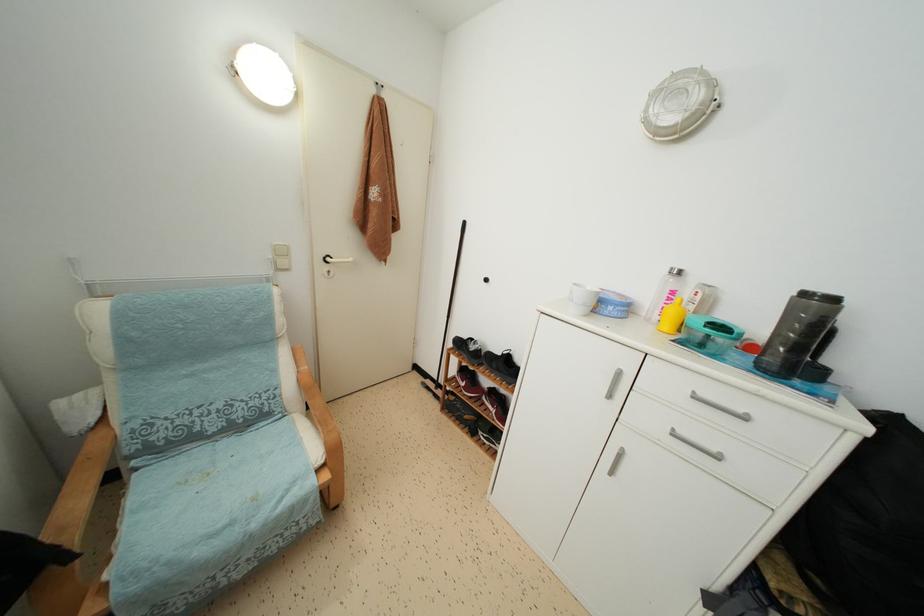
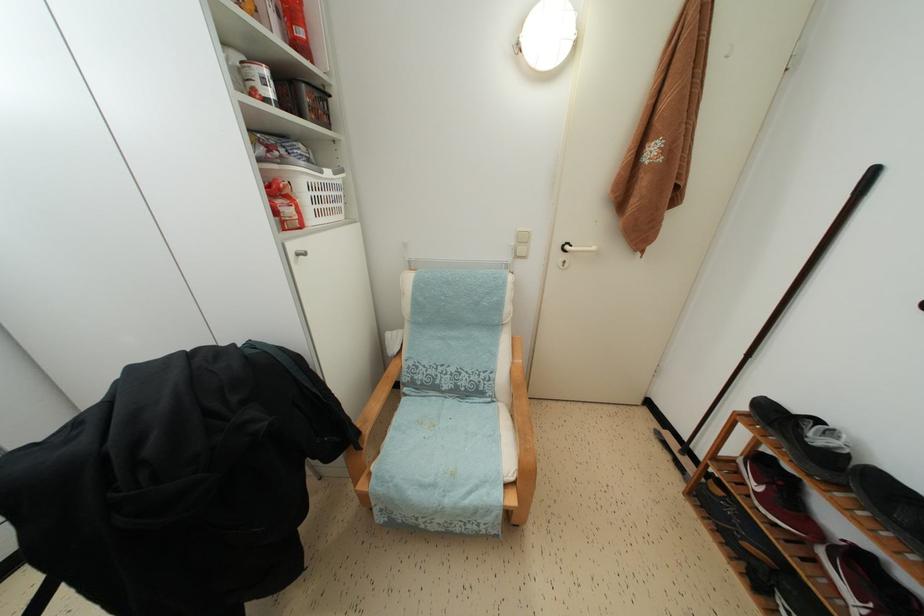
Where in the second image is the point corresponding to (x=467, y=390) from the first image?

(760, 493)